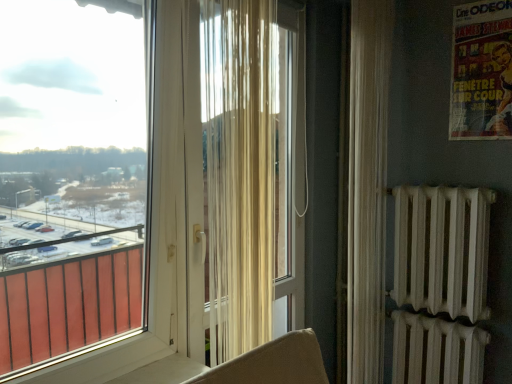
Question: Is matte paper poster at upper right outside of sheer white curtain at right, which ranks as the 2th curtain in front-to-back order?

Choices:
 (A) no
 (B) yes

Answer: (B)

Question: Can you confirm if matte paper poster at upper right is thinner than sheer white curtain at right, which is the 1th curtain in back-to-front order?

Choices:
 (A) yes
 (B) no

Answer: (A)

Question: From the image's perspective, is matte paper poster at upper right above sheer white curtain at right, which is the 1th curtain in back-to-front order?

Choices:
 (A) yes
 (B) no

Answer: (A)

Question: Is matte paper poster at upper right placed right next to sheer white curtain at right, which is the 1th curtain in back-to-front order?

Choices:
 (A) no
 (B) yes

Answer: (A)

Question: Considering the relative sizes of matte paper poster at upper right and sheer white curtain at right, which ranks as the 2th curtain in front-to-back order, in the image provided, is matte paper poster at upper right taller than sheer white curtain at right, which ranks as the 2th curtain in front-to-back order,?

Choices:
 (A) yes
 (B) no

Answer: (B)

Question: Considering the relative sizes of matte paper poster at upper right and sheer white curtain at right, the 1th curtain positioned from the right, in the image provided, is matte paper poster at upper right wider than sheer white curtain at right, the 1th curtain positioned from the right,?

Choices:
 (A) yes
 (B) no

Answer: (B)

Question: From a real-world perspective, is sheer white curtain at right, which ranks as the 2th curtain in front-to-back order, on transparent plastic window at upper left?

Choices:
 (A) yes
 (B) no

Answer: (B)

Question: Can you confirm if sheer white curtain at right, which appears as the second curtain when viewed from the left, is wider than transparent plastic window at upper left?

Choices:
 (A) no
 (B) yes

Answer: (A)

Question: Is sheer white curtain at right, which ranks as the 2th curtain in front-to-back order, positioned beyond the bounds of transparent plastic window at upper left?

Choices:
 (A) no
 (B) yes

Answer: (B)

Question: Is sheer white curtain at right, which is the 1th curtain in back-to-front order, positioned far away from transparent plastic window at upper left?

Choices:
 (A) no
 (B) yes

Answer: (B)

Question: Is sheer white curtain at right, which is the 1th curtain in back-to-front order, touching transparent plastic window at upper left?

Choices:
 (A) yes
 (B) no

Answer: (B)

Question: Is sheer white curtain at right, which ranks as the 2th curtain in front-to-back order, at the left side of transparent plastic window at upper left?

Choices:
 (A) no
 (B) yes

Answer: (A)

Question: Would you say transparent plastic window at upper left is outside matte paper poster at upper right?

Choices:
 (A) no
 (B) yes

Answer: (B)